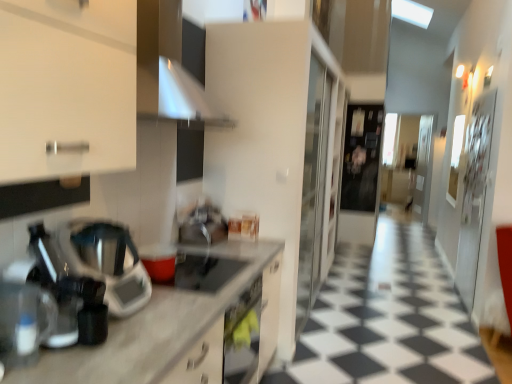
This screenshot has height=384, width=512. Identify the location of satin silver exhaust hood at upper center. (172, 66).

Measure the distance between point (228, 315) and camera.

Point (228, 315) is 6.73 feet from camera.

This screenshot has height=384, width=512. What do you see at coordinates (170, 323) in the screenshot?
I see `white marble countertop at left` at bounding box center [170, 323].

Measure the distance between transparent plastic coffee machine at left, the second coffee machine from the back, and camera.

transparent plastic coffee machine at left, the second coffee machine from the back, is 1.22 meters away from camera.

The width and height of the screenshot is (512, 384). Describe the element at coordinates (24, 317) in the screenshot. I see `transparent plastic coffee machine at left, the second coffee machine from the back` at that location.

You are a GUI agent. You are given a task and a screenshot of the screen. Output one action in this format:
    pyautogui.click(x=<x>, y=<y>)
    Task: Click on the matte black gas stove at center
    The image size is (512, 384).
    Given the screenshot: What is the action you would take?
    (203, 271)

This screenshot has width=512, height=384. What do you see at coordinates (203, 226) in the screenshot?
I see `satin silver sink at center` at bounding box center [203, 226].

Image resolution: width=512 pixels, height=384 pixels. Find the location of `sleek metallic coffee machine at left, which ranks as the first coffee machine in back-to-front order`. sleek metallic coffee machine at left, which ranks as the first coffee machine in back-to-front order is located at coordinates (68, 294).

In terms of height, does satin silver sink at center look taller or shorter compared to metallic silver blender at left?

In the image, satin silver sink at center appears to be shorter than metallic silver blender at left.

Which of these two, satin silver sink at center or metallic silver blender at left, is wider?

metallic silver blender at left is wider.

Is satin silver sink at center looking in the opposite direction of metallic silver blender at left?

No, satin silver sink at center is not facing away from metallic silver blender at left.

Is transparent plastic coffee machine at left, which is counted as the 1th coffee machine, starting from the front, bigger or smaller than satin silver exhaust hood at upper center?

Clearly, transparent plastic coffee machine at left, which is counted as the 1th coffee machine, starting from the front, is smaller in size than satin silver exhaust hood at upper center.

Can you tell me how much transparent plastic coffee machine at left, which is counted as the 1th coffee machine, starting from the front, and satin silver exhaust hood at upper center differ in facing direction?

0.00292 degrees separate the facing orientations of transparent plastic coffee machine at left, which is counted as the 1th coffee machine, starting from the front, and satin silver exhaust hood at upper center.

Can you confirm if transparent plastic coffee machine at left, the second coffee machine from the back, is positioned to the left of satin silver exhaust hood at upper center?

Correct, you'll find transparent plastic coffee machine at left, the second coffee machine from the back, to the left of satin silver exhaust hood at upper center.

In terms of height, does transparent plastic coffee machine at left, which is counted as the 1th coffee machine, starting from the front, look taller or shorter compared to satin silver exhaust hood at upper center?

In the image, transparent plastic coffee machine at left, which is counted as the 1th coffee machine, starting from the front, appears to be shorter than satin silver exhaust hood at upper center.

From the picture: Which is closer, (35, 331) or (197, 272)?

The point (35, 331) is closer to the camera.

Is transparent plastic coffee machine at left, which is counted as the 1th coffee machine, starting from the front, oriented towards matte black gas stove at center?

No, transparent plastic coffee machine at left, which is counted as the 1th coffee machine, starting from the front, is not turned towards matte black gas stove at center.

Considering the relative sizes of transparent plastic coffee machine at left, which is counted as the 1th coffee machine, starting from the front, and matte black gas stove at center in the image provided, is transparent plastic coffee machine at left, which is counted as the 1th coffee machine, starting from the front, smaller than matte black gas stove at center?

No, transparent plastic coffee machine at left, which is counted as the 1th coffee machine, starting from the front, is not smaller than matte black gas stove at center.

Could matte black gas stove at center be considered to be inside transparent plastic coffee machine at left, the second coffee machine from the back?

That's incorrect, matte black gas stove at center is not inside transparent plastic coffee machine at left, the second coffee machine from the back.

Considering the sizes of objects white marble countertop at left and matte black gas stove at center in the image provided, who is wider, white marble countertop at left or matte black gas stove at center?

white marble countertop at left is wider.

Can we say white marble countertop at left lies outside matte black gas stove at center?

white marble countertop at left lies outside matte black gas stove at center's area.

How much distance is there between white marble countertop at left and matte black gas stove at center?

white marble countertop at left is 5.02 inches away from matte black gas stove at center.

Is white marble countertop at left positioned with its back to matte black gas stove at center?

No, white marble countertop at left's orientation is not away from matte black gas stove at center.

Is sleek metallic coffee machine at left, which ranks as the first coffee machine in back-to-front order, positioned beyond the bounds of black glossy tile at center?

That's correct, sleek metallic coffee machine at left, which ranks as the first coffee machine in back-to-front order, is outside of black glossy tile at center.

Considering the relative sizes of sleek metallic coffee machine at left, which ranks as the first coffee machine in back-to-front order, and black glossy tile at center in the image provided, is sleek metallic coffee machine at left, which ranks as the first coffee machine in back-to-front order, wider than black glossy tile at center?

No, sleek metallic coffee machine at left, which ranks as the first coffee machine in back-to-front order, is not wider than black glossy tile at center.

Measure the distance between sleek metallic coffee machine at left, which ranks as the first coffee machine in back-to-front order, and black glossy tile at center.

They are 2.15 meters apart.

From a real-world perspective, does sleek metallic coffee machine at left, which ranks as the first coffee machine in back-to-front order, sit lower than black glossy tile at center?

No, from a real-world perspective, sleek metallic coffee machine at left, which ranks as the first coffee machine in back-to-front order, is not below black glossy tile at center.

In terms of size, does matte black gas stove at center appear bigger or smaller than sleek metallic coffee machine at left, arranged as the second coffee machine when viewed from the front?

matte black gas stove at center is smaller than sleek metallic coffee machine at left, arranged as the second coffee machine when viewed from the front.

Is matte black gas stove at center inside or outside of sleek metallic coffee machine at left, which ranks as the first coffee machine in back-to-front order?

matte black gas stove at center is outside sleek metallic coffee machine at left, which ranks as the first coffee machine in back-to-front order.

From the image's perspective, who appears lower, matte black gas stove at center or sleek metallic coffee machine at left, which ranks as the first coffee machine in back-to-front order?

matte black gas stove at center, from the image's perspective.

Is satin silver exhaust hood at upper center to the right of satin silver sink at center from the viewer's perspective?

Yes.

Does point (161, 109) come closer to viewer compared to point (214, 227)?

Yes, it is.

Who is shorter, satin silver exhaust hood at upper center or satin silver sink at center?

Standing shorter between the two is satin silver sink at center.

Identify the location of appliance behind the metallic silver blender at left. This screenshot has height=384, width=512. (203, 226).

This screenshot has height=384, width=512. I want to click on the 2nd coffee machine below the satin silver exhaust hood at upper center (from the image's perspective), so click(x=24, y=317).

From the image, which object appears to be nearer to white marble countertop at left, sleek metallic coffee machine at left, which ranks as the first coffee machine in back-to-front order, or black glossy tile at center?

The object closer to white marble countertop at left is sleek metallic coffee machine at left, which ranks as the first coffee machine in back-to-front order.

From the image, which object appears to be nearer to white marble countertop at left, satin silver exhaust hood at upper center or metallic silver blender at left?

metallic silver blender at left is closer to white marble countertop at left.

Based on the photo, which object lies further to the anchor point satin silver sink at center, white marble countertop at left or transparent plastic coffee machine at left, the second coffee machine from the back?

transparent plastic coffee machine at left, the second coffee machine from the back.

When comparing their distances from satin silver exhaust hood at upper center, does satin silver sink at center or matte black gas stove at center seem closer?

matte black gas stove at center.

When comparing their distances from transparent plastic coffee machine at left, the second coffee machine from the back, does satin silver sink at center or satin silver exhaust hood at upper center seem closer?

satin silver exhaust hood at upper center is closer to transparent plastic coffee machine at left, the second coffee machine from the back.

Looking at the image, which one is located closer to black glossy tile at center, sleek metallic coffee machine at left, arranged as the second coffee machine when viewed from the front, or matte black gas stove at center?

Among the two, matte black gas stove at center is located nearer to black glossy tile at center.

From the image, which object appears to be farther from sleek metallic coffee machine at left, which ranks as the first coffee machine in back-to-front order, satin silver exhaust hood at upper center or black glossy tile at center?

The object further to sleek metallic coffee machine at left, which ranks as the first coffee machine in back-to-front order, is black glossy tile at center.

When comparing their distances from satin silver exhaust hood at upper center, does matte black gas stove at center or metallic silver blender at left seem further?

matte black gas stove at center.

Identify the location of home appliance positioned between transparent plastic coffee machine at left, the second coffee machine from the back, and satin silver sink at center from near to far. (106, 262).

This screenshot has height=384, width=512. Find the location of `countertop between sleek metallic coffee machine at left, arranged as the second coffee machine when viewed from the front, and black glossy tile at center`. countertop between sleek metallic coffee machine at left, arranged as the second coffee machine when viewed from the front, and black glossy tile at center is located at coordinates (170, 323).

At what (x,y) coordinates should I click in order to perform the action: click on exhaust hood between transparent plastic coffee machine at left, the second coffee machine from the back, and satin silver sink at center in the front-back direction. Please return your answer as a coordinate pair (x, y). Looking at the image, I should click on (172, 66).

The width and height of the screenshot is (512, 384). Identify the location of gas stove between sleek metallic coffee machine at left, which ranks as the first coffee machine in back-to-front order, and black glossy tile at center, in the horizontal direction. (203, 271).